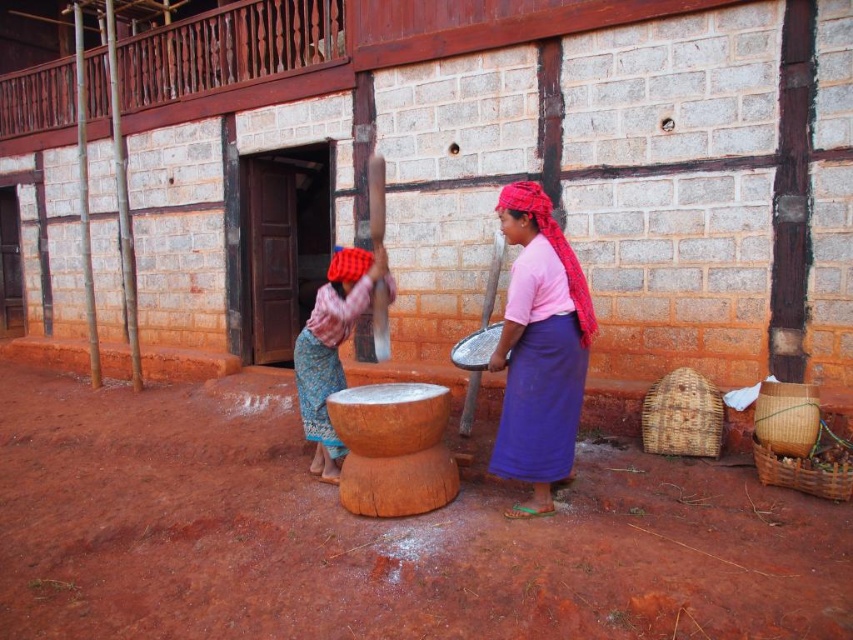
You are an observer standing in front of the brick building. You see a pink fabric skirt at center and a matte pink fabric at center. Which one is positioned to the right?

The pink fabric skirt at center is positioned to the right of the matte pink fabric at center.

You are a tailor who needs to choose between the pink fabric skirt at center and the matte pink fabric at center for a new dress pattern. Which fabric option has a larger size available?

The matte pink fabric at center has a larger size compared to the pink fabric skirt at center, so it would be the better choice for a new dress pattern requiring more material.